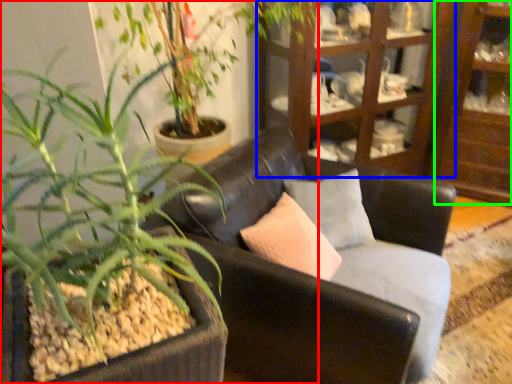
Question: Estimate the real-world distances between objects in this image. Which object is farther from houseplant (highlighted by a red box), cabinetry (highlighted by a blue box) or shelf (highlighted by a green box)?

Choices:
 (A) cabinetry
 (B) shelf

Answer: (B)